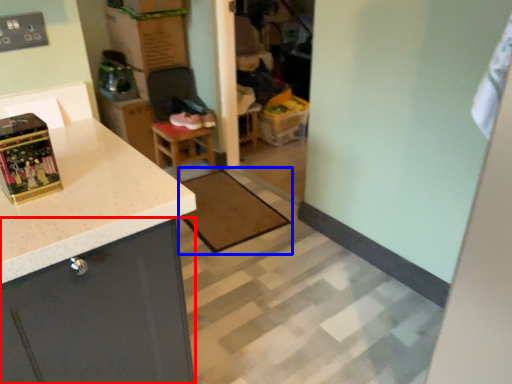
Question: Which of the following is the closest to the observer, cabinetry (highlighted by a red box) or mat (highlighted by a blue box)?

Choices:
 (A) cabinetry
 (B) mat

Answer: (A)